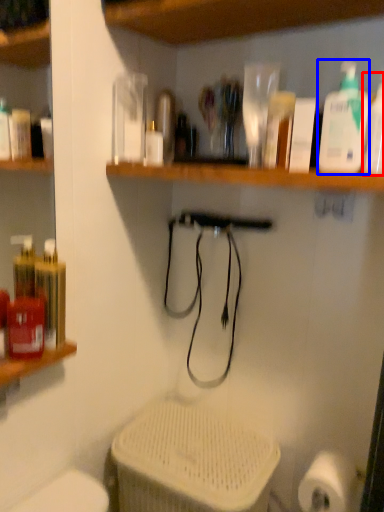
Question: Which point is further to the camera, cleaning product (highlighted by a red box) or cleaning product (highlighted by a blue box)?

Choices:
 (A) cleaning product
 (B) cleaning product

Answer: (B)